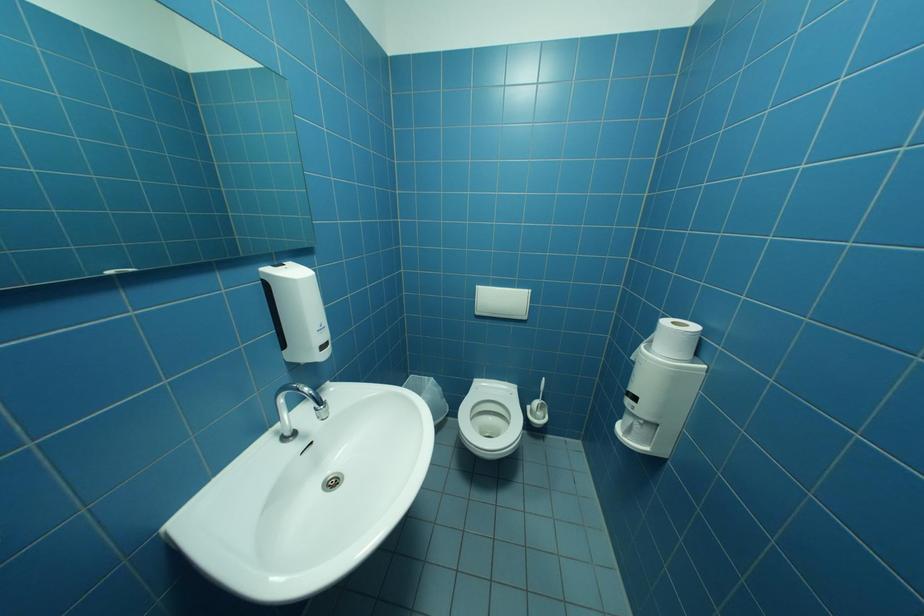
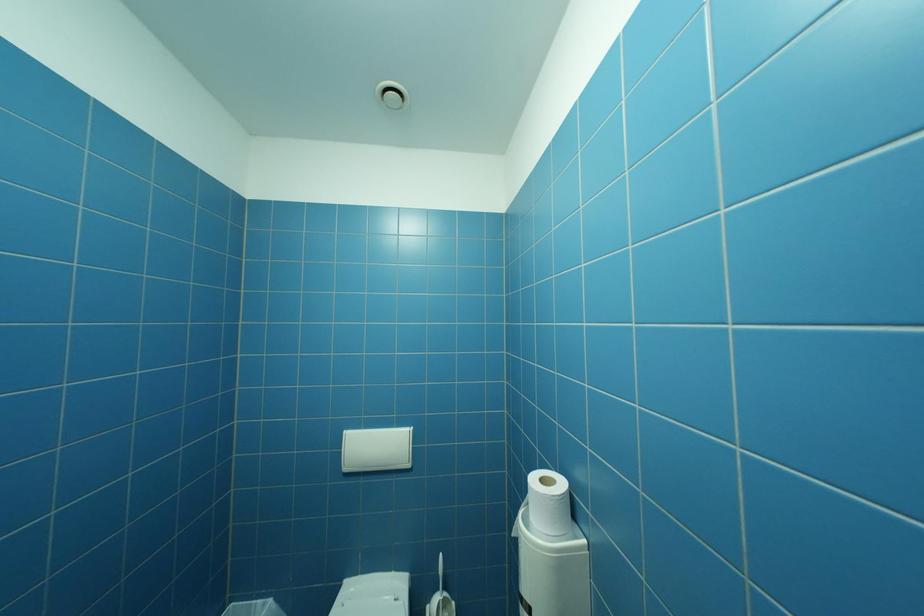
Question: What movement of the cameraman would produce the second image?

Choices:
 (A) Left
 (B) Right
 (C) Forward
 (D) Backward

Answer: (B)